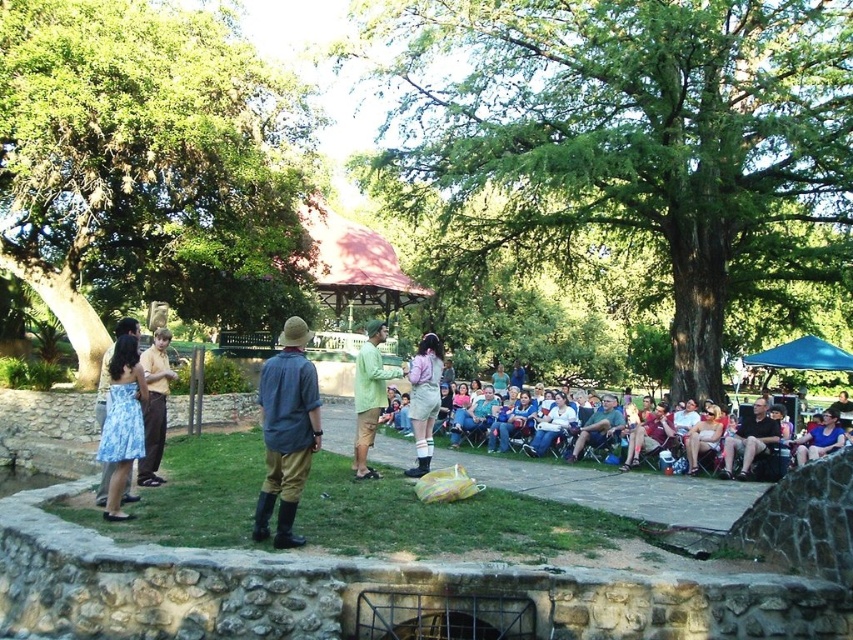
Which of these two, green matte shirt at center or pink fabric overalls at center, stands shorter?

pink fabric overalls at center

Is point (364, 429) positioned after point (425, 458)?

No, (364, 429) is closer to viewer.

Is point (378, 400) closer to camera compared to point (416, 364)?

Yes, it is.

At what (x,y) coordinates should I click in order to perform the action: click on green matte shirt at center. Please return your answer as a coordinate pair (x, y). Looking at the image, I should click on (369, 396).

From the picture: Can you confirm if green matte shirt at center is bigger than dark gray fabric chair at lower right?

Correct, green matte shirt at center is larger in size than dark gray fabric chair at lower right.

Between green matte shirt at center and dark gray fabric chair at lower right, which one is positioned higher?

green matte shirt at center

Is point (372, 472) in front of point (759, 417)?

Yes.

This screenshot has height=640, width=853. I want to click on green matte shirt at center, so click(x=369, y=396).

Who is more forward, [117,410] or [157,449]?

Positioned in front is point [117,410].

Does point (108, 401) come closer to viewer compared to point (155, 477)?

Yes, point (108, 401) is in front of point (155, 477).

Find the location of a particular element. The height and width of the screenshot is (640, 853). blue floral dress at lower left is located at coordinates (122, 420).